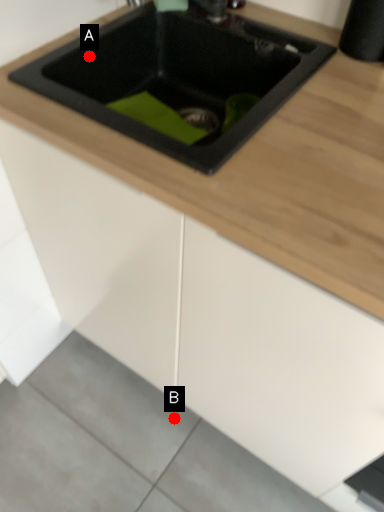
Question: Two points are circled on the image, labeled by A and B beside each circle. Which point is closer to the camera?

Choices:
 (A) A is closer
 (B) B is closer

Answer: (A)